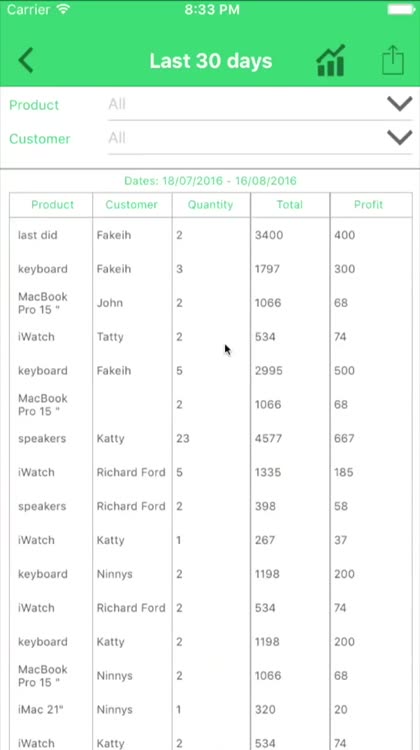
Identify the location of word keyboard. The height and width of the screenshot is (750, 420). (36, 644), (39, 573), (41, 368), (42, 266).